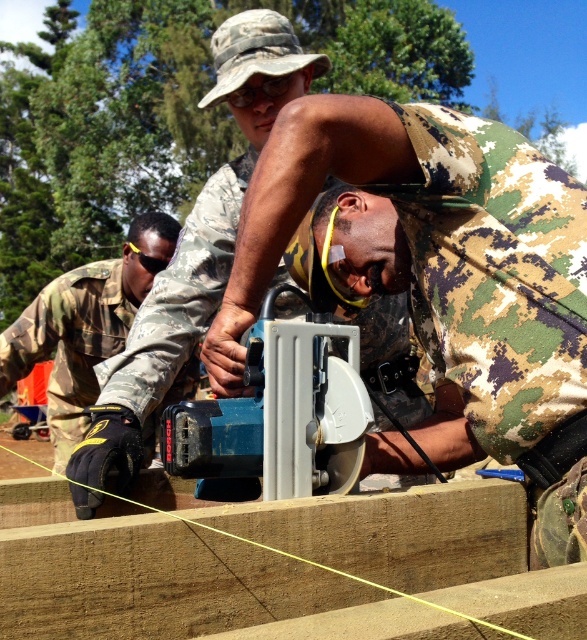
Question: Estimate the real-world distances between objects in this image. Which object is closer to the camouflage fabric at center?

Choices:
 (A) camo fabric man at center
 (B) camouflage uniform at left
 (C) brown wood plank at center
 (D) blue plastic saw at center

Answer: (D)

Question: Does camouflage fabric at center have a lesser width compared to camouflage uniform at left?

Choices:
 (A) yes
 (B) no

Answer: (B)

Question: Where is camo fabric man at center located in relation to blue plastic saw at center in the image?

Choices:
 (A) right
 (B) left

Answer: (B)

Question: Where is camo fabric man at center located in relation to blue plastic saw at center in the image?

Choices:
 (A) left
 (B) right

Answer: (A)

Question: Which of the following is the farthest from the observer?

Choices:
 (A) (330, 596)
 (B) (541, 532)
 (C) (75, 268)

Answer: (C)

Question: Which object is positioned farthest from the brown wood plank at center?

Choices:
 (A) camouflage fabric at center
 (B) blue plastic saw at center
 (C) camo fabric man at center

Answer: (C)